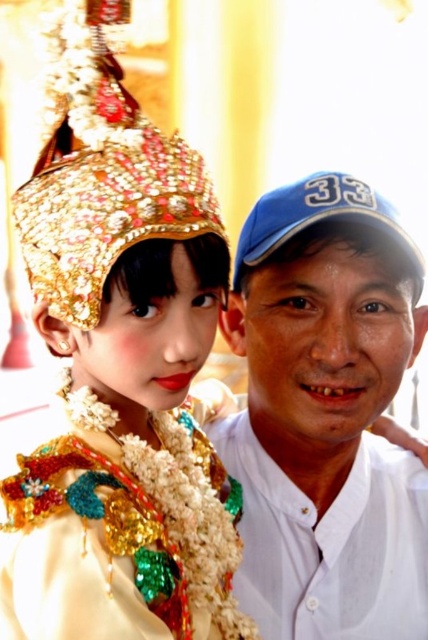
Who is positioned more to the left, white cotton shirt at center or iridescent sequined fabric at center?

From the viewer's perspective, iridescent sequined fabric at center appears more on the left side.

Is point (261, 579) farther from viewer compared to point (112, 408)?

Yes, point (261, 579) is behind point (112, 408).

Image resolution: width=428 pixels, height=640 pixels. In order to click on white cotton shirt at center in this screenshot , I will do `click(326, 416)`.

Where is `white cotton shirt at center`? white cotton shirt at center is located at coordinates (326, 416).

Between point (56, 96) and point (89, 84), which one is positioned in front?

Positioned in front is point (89, 84).

Looking at this image, is shiny gold crown at upper left to the left of gold jeweled headdress at upper left from the viewer's perspective?

In fact, shiny gold crown at upper left is to the right of gold jeweled headdress at upper left.

Does point (89, 109) come farther from viewer compared to point (56, 221)?

Yes, it is.

The width and height of the screenshot is (428, 640). I want to click on shiny gold crown at upper left, so coord(121,371).

Is white cotton shirt at center in front of gold jeweled headdress at upper left?

No, it is not.

Can you confirm if white cotton shirt at center is taller than gold jeweled headdress at upper left?

Correct, white cotton shirt at center is much taller as gold jeweled headdress at upper left.

Where is `white cotton shirt at center`? This screenshot has height=640, width=428. white cotton shirt at center is located at coordinates (326, 416).